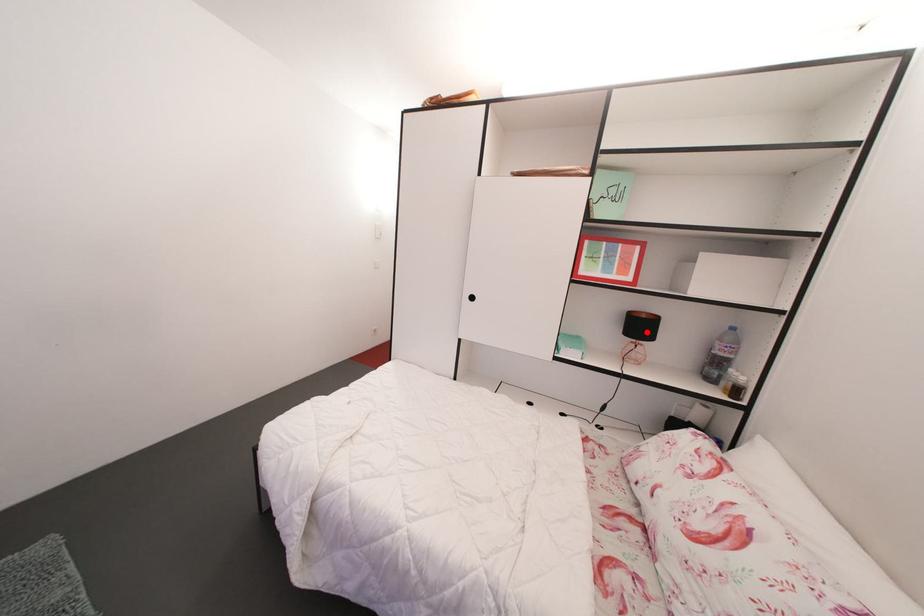
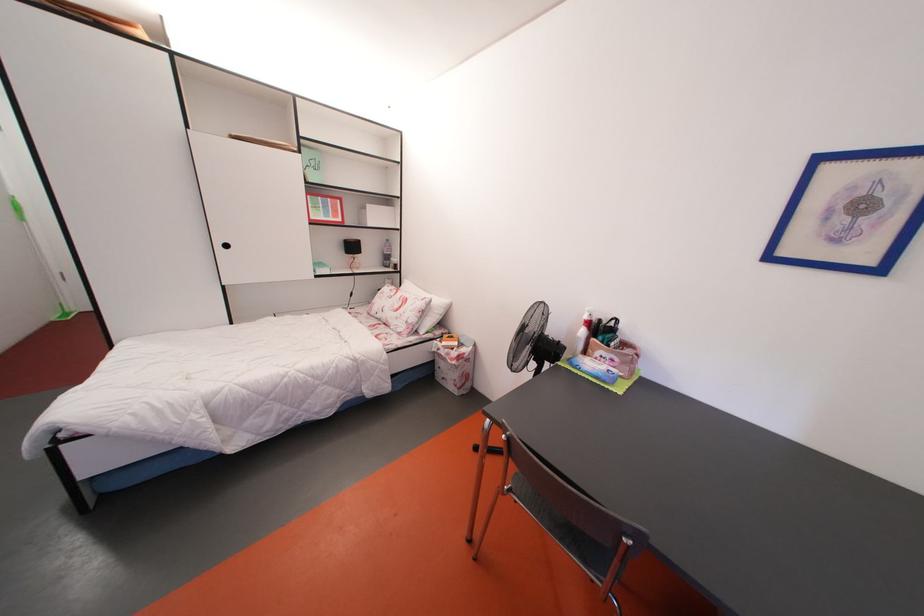
Question: I am providing you with two images of the same scene from different viewpoints. Given a red point in image1, look at the same physical point in image2. Is it:

Choices:
 (A) Closer to the viewpoint
 (B) Farther from the viewpoint

Answer: (A)